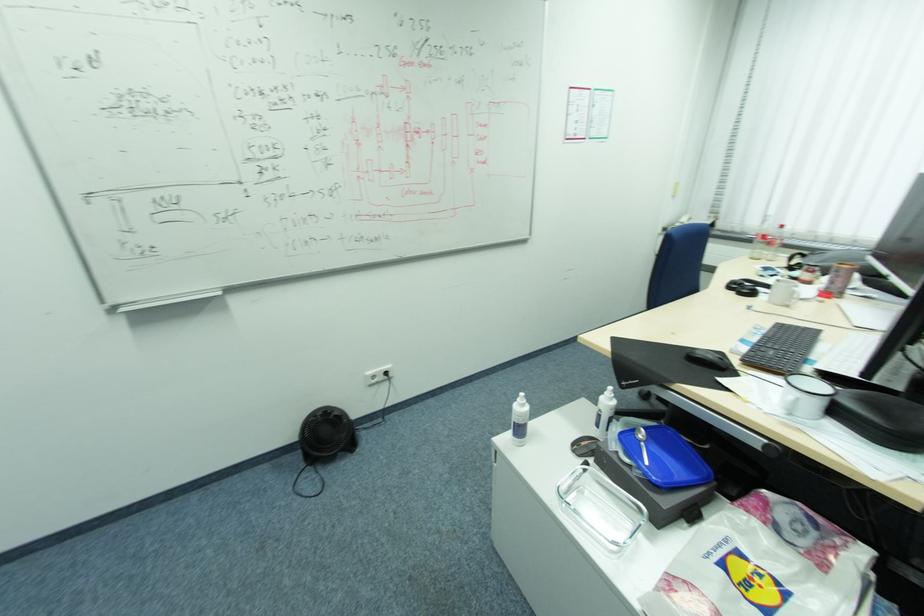
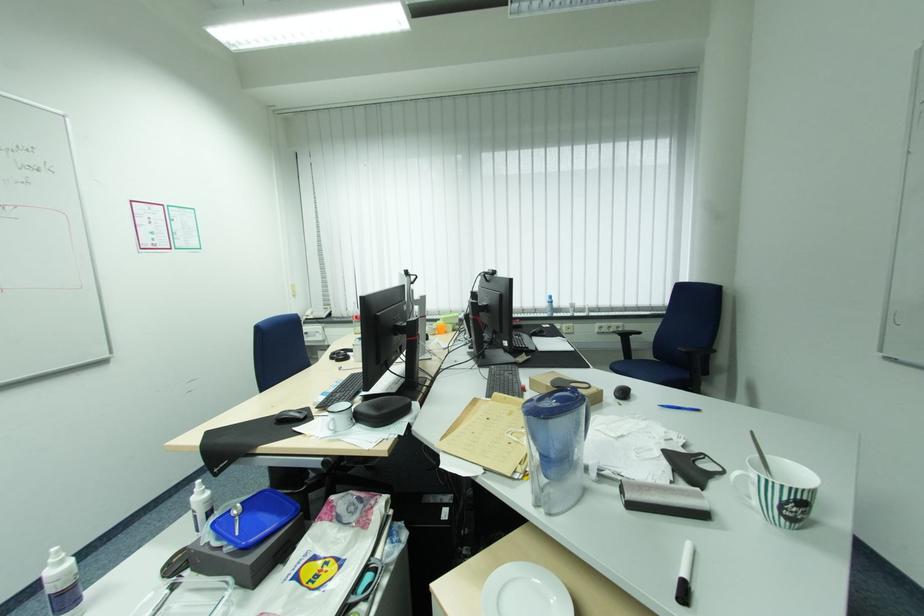
In the second image, find the point that corresponds to (528,392) in the first image.

(62, 548)